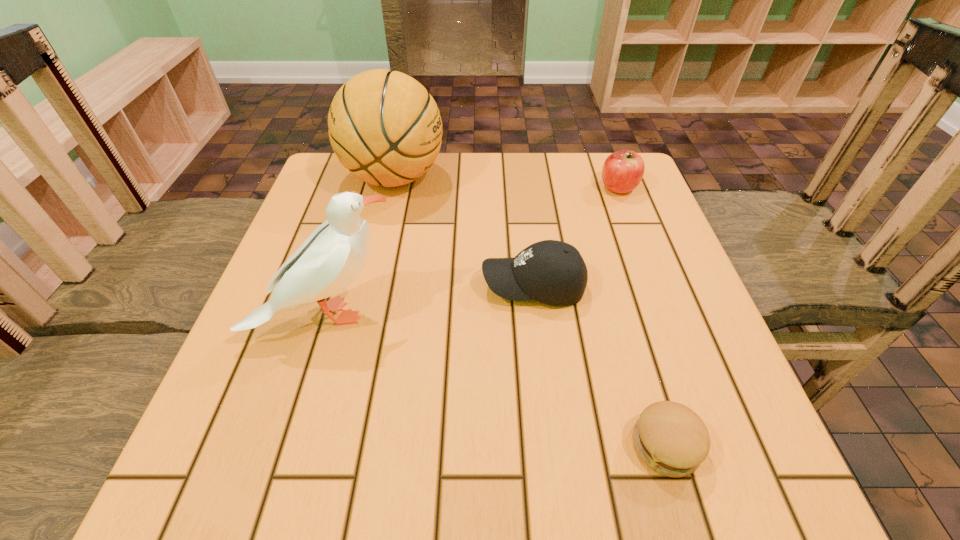
Identify the location of basketball. Image resolution: width=960 pixels, height=540 pixels. (384, 126).

Where is `gull`? gull is located at coordinates (329, 260).

Locate an element on the screen. apple is located at coordinates (623, 170).

Where is `the third object from right to left`? the third object from right to left is located at coordinates (552, 272).

Locate an element on the screen. the shortest object is located at coordinates (670, 438).

Where is `hamburger`? hamburger is located at coordinates coord(670,438).

You are a GUI agent. You are given a task and a screenshot of the screen. Output one action in this format:
    pyautogui.click(x=<x>, y=<y>)
    Task: Click on the vacant space situated 0.070m on the surface of the basketball near the brand logo
    
    Given the screenshot: What is the action you would take?
    pyautogui.click(x=473, y=178)

Image resolution: width=960 pixels, height=540 pixels. Find the location of `vacant area situated at the beak of the gull`. vacant area situated at the beak of the gull is located at coordinates (604, 315).

Where is `vacant space situated 0.290m on the front of the apple`? vacant space situated 0.290m on the front of the apple is located at coordinates (658, 288).

Identify the location of vacant space located 0.140m on the front-facing side of the baseball cap. (411, 286).